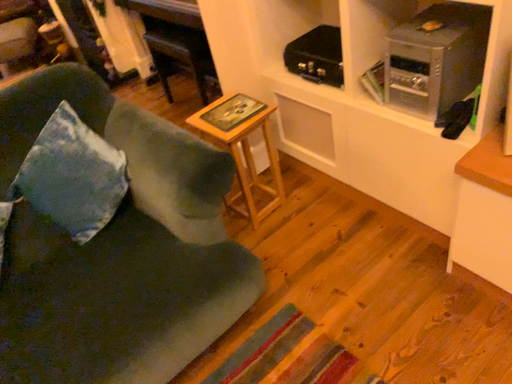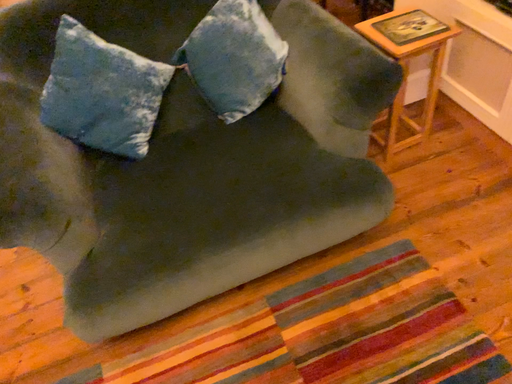
Question: Which way did the camera rotate in the video?

Choices:
 (A) rotated upward
 (B) rotated downward

Answer: (B)